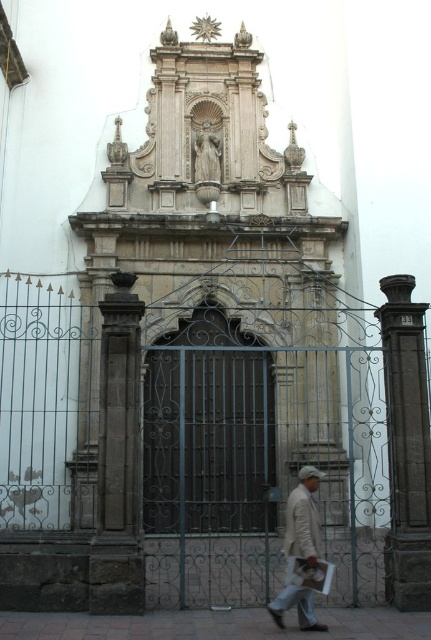
Can you confirm if dark wrought iron gate at center is taller than white matte jacket at lower center?

Yes, dark wrought iron gate at center is taller than white matte jacket at lower center.

Can you confirm if dark wrought iron gate at center is positioned to the left of white matte jacket at lower center?

Correct, you'll find dark wrought iron gate at center to the left of white matte jacket at lower center.

I want to click on dark wrought iron gate at center, so click(x=209, y=428).

Find the location of a particular element. dark wrought iron gate at center is located at coordinates (209, 428).